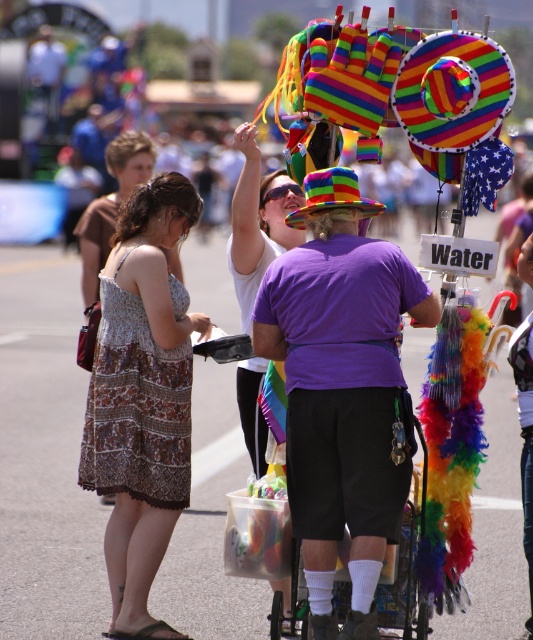
You are a photographer trying to capture the vendor and their cart in a single frame. Given that the matte white shirt at center and the multicolored feathered cart at center are both in your view, which object should you focus on first to ensure both are in the frame without moving the camera?

Since the matte white shirt at center has a lesser width compared to the multicolored feathered cart at center, you should focus on the multicolored feathered cart at center first as it is wider and requires more space in the frame.

You are a photographer trying to capture the vendor and their cart in a single frame. Given that your camera has a limited zoom, which object should you focus on first to ensure both the purple cotton shirt at center and the multicolored feathered cart at center are in the frame?

The purple cotton shirt at center is bigger than the multicolored feathered cart at center, so you should focus on the purple cotton shirt at center first to ensure both are in frame.